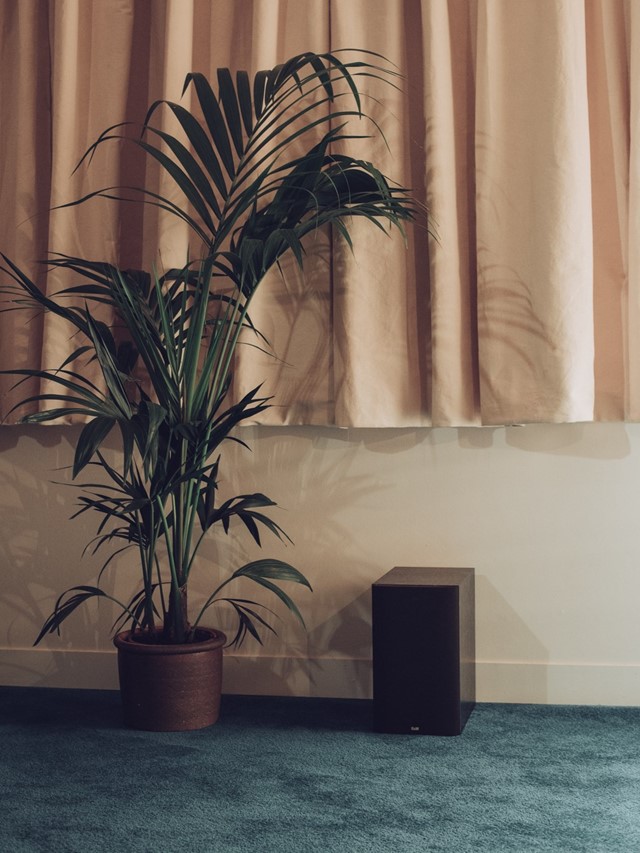
Find the location of a particular element. pot is located at coordinates (196, 672).